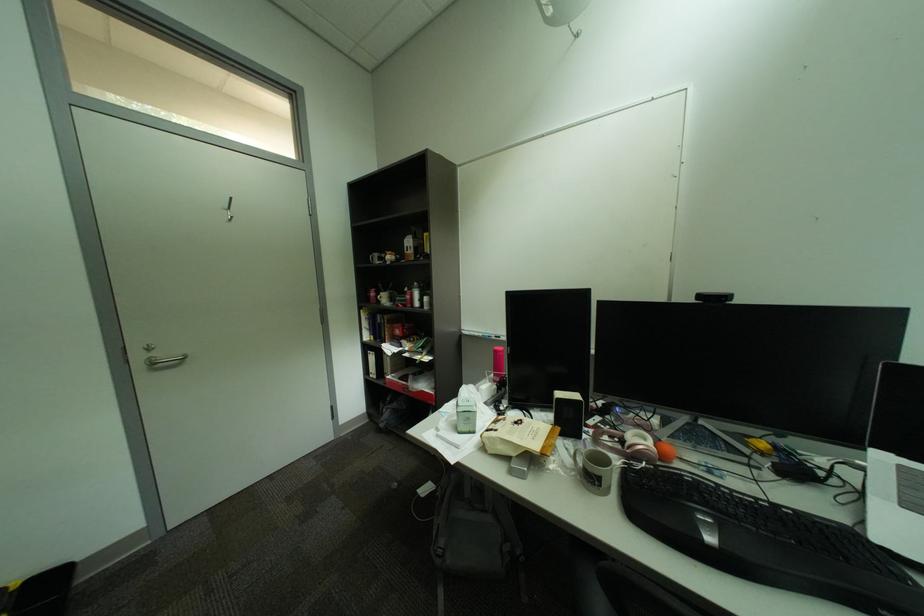
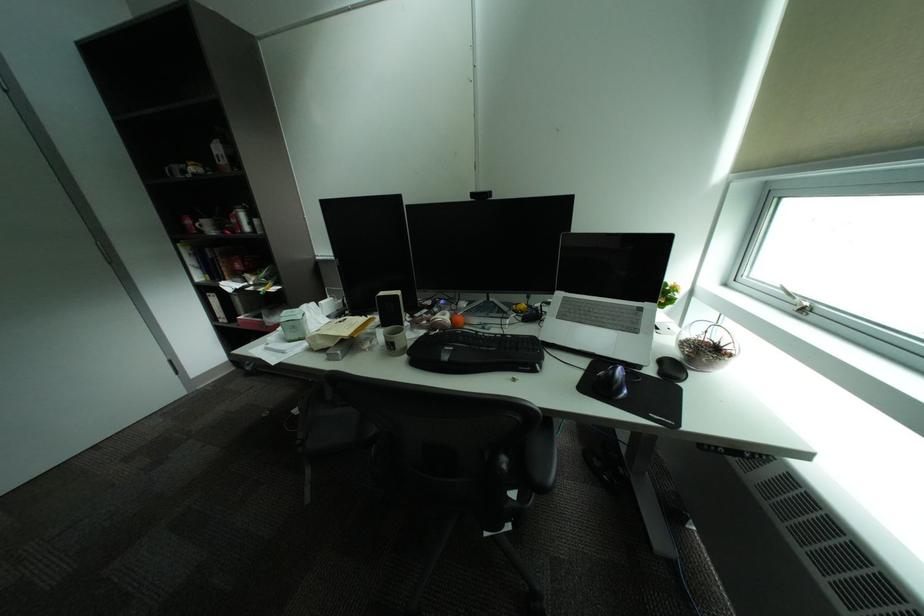
The point at (x=383, y=296) is marked in the first image. Where is the corresponding point in the second image?

(199, 223)